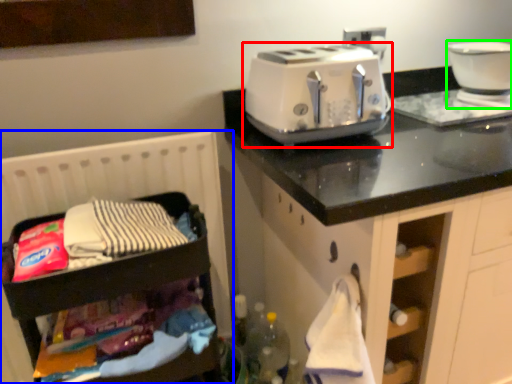
Question: Which is nearer to the toaster (highlighted by a red box)? infant bed (highlighted by a blue box) or home appliance (highlighted by a green box).

Choices:
 (A) infant bed
 (B) home appliance

Answer: (A)